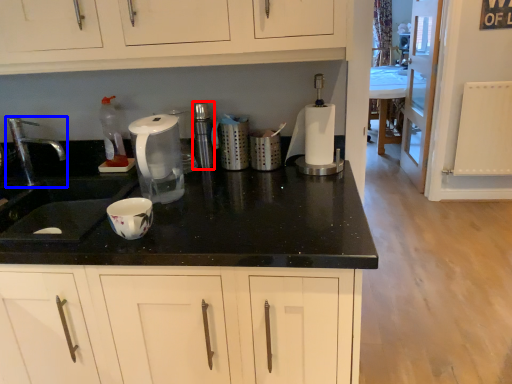
Question: Which of the following is the closest to the observer, appliance (highlighted by a red box) or tap (highlighted by a blue box)?

Choices:
 (A) appliance
 (B) tap

Answer: (B)